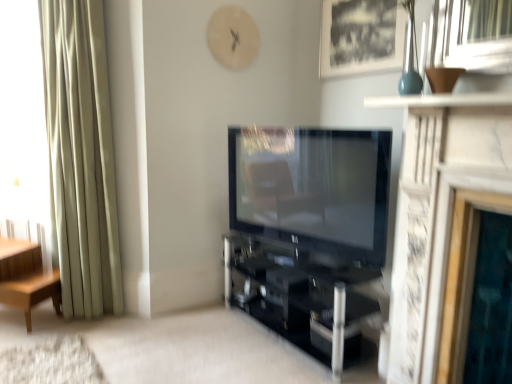
The image size is (512, 384). Describe the element at coordinates (312, 188) in the screenshot. I see `matte black tv at center` at that location.

Locate an element on the screen. The height and width of the screenshot is (384, 512). silky beige curtain at left is located at coordinates (81, 157).

Measure the distance between point (x=399, y=55) and camera.

Point (x=399, y=55) is 7.58 feet from camera.

Where is `black glass shelf at center`? black glass shelf at center is located at coordinates (300, 296).

What do you see at coordinates (26, 277) in the screenshot?
I see `light brown wood side table at left` at bounding box center [26, 277].

This screenshot has height=384, width=512. Find the location of `matte black tv at center`. matte black tv at center is located at coordinates (312, 188).

Considering the sizes of black glass shelf at center and light brown wood side table at left in the image, is black glass shelf at center taller or shorter than light brown wood side table at left?

In the image, black glass shelf at center appears to be shorter than light brown wood side table at left.

In order to click on shelf above the light brown wood side table at left (from a real-world perspective) in this screenshot , I will do `click(300, 296)`.

Between black glass shelf at center and light brown wood side table at left, which one has larger size?

With larger size is black glass shelf at center.

In the image, is black glass shelf at center on the left side or the right side of light brown wood side table at left?

From the image, it's evident that black glass shelf at center is to the right of light brown wood side table at left.

Considering the relative sizes of matte black tv at center and black glass shelf at center in the image provided, is matte black tv at center bigger than black glass shelf at center?

No, matte black tv at center is not bigger than black glass shelf at center.

Considering the positions of objects matte black tv at center and black glass shelf at center in the image provided, who is in front, matte black tv at center or black glass shelf at center?

matte black tv at center is more forward.

From a real-world perspective, which object stands above the other?

From a 3D spatial view, matte black tv at center is above.

Could you tell me if matte black tv at center is facing black glass shelf at center?

No, matte black tv at center is not turned towards black glass shelf at center.

Is silky beige curtain at left at the back of black glass shelf at center?

No, black glass shelf at center is not facing away from silky beige curtain at left.

You are a GUI agent. You are given a task and a screenshot of the screen. Output one action in this format:
    pyautogui.click(x=<x>, y=<y>)
    Task: Click on the shelf below the silky beige curtain at left (from the image's perspective)
    
    Given the screenshot: What is the action you would take?
    pyautogui.click(x=300, y=296)

Does black glass shelf at center have a smaller size compared to silky beige curtain at left?

No.

Considering the points (304, 304) and (84, 135), which point is behind, point (304, 304) or point (84, 135)?

Positioned behind is point (84, 135).

Between silky beige curtain at left and matte black tv at center, which one has smaller size?

Smaller between the two is matte black tv at center.

Is silky beige curtain at left spatially inside matte black tv at center, or outside of it?

silky beige curtain at left is not inside matte black tv at center, it's outside.

From the image's perspective, is silky beige curtain at left beneath matte black tv at center?

No, from the image's perspective, silky beige curtain at left is not below matte black tv at center.

Is silky beige curtain at left far from matte black tv at center?

Yes, silky beige curtain at left and matte black tv at center are located far from each other.

Considering the sizes of black matte picture frame at upper center and light brown wood side table at left in the image, is black matte picture frame at upper center taller or shorter than light brown wood side table at left?

Clearly, black matte picture frame at upper center is taller compared to light brown wood side table at left.

From the image's perspective, between black matte picture frame at upper center and light brown wood side table at left, which one is located above?

black matte picture frame at upper center appears higher in the image.

In the image, is black matte picture frame at upper center on the left side or the right side of light brown wood side table at left?

black matte picture frame at upper center is to the right of light brown wood side table at left.

Considering the sizes of objects black matte picture frame at upper center and light brown wood side table at left in the image provided, who is bigger, black matte picture frame at upper center or light brown wood side table at left?

Bigger between the two is light brown wood side table at left.

Would you say white marble fireplace at center is a long distance from light brown wood side table at left?

Yes, white marble fireplace at center is far from light brown wood side table at left.

Considering the relative positions of white marble fireplace at center and light brown wood side table at left in the image provided, is white marble fireplace at center in front of light brown wood side table at left?

Yes, white marble fireplace at center is in front of light brown wood side table at left.

Considering the sizes of objects white marble fireplace at center and light brown wood side table at left in the image provided, who is thinner, white marble fireplace at center or light brown wood side table at left?

Thinner between the two is light brown wood side table at left.

Is silky beige curtain at left wider or thinner than black glass shelf at center?

Considering their sizes, silky beige curtain at left looks slimmer than black glass shelf at center.

From a real-world perspective, is silky beige curtain at left above or below black glass shelf at center?

In terms of real-world spatial position, silky beige curtain at left is above black glass shelf at center.

Does silky beige curtain at left have a larger size compared to black glass shelf at center?

No, silky beige curtain at left is not bigger than black glass shelf at center.

Is silky beige curtain at left at the right side of black glass shelf at center?

No.

The image size is (512, 384). Find the location of `furniture that is under the black glass shelf at center (from a real-world perspective)`. furniture that is under the black glass shelf at center (from a real-world perspective) is located at coordinates (26, 277).

Image resolution: width=512 pixels, height=384 pixels. I want to click on shelf to the right of matte black tv at center, so click(x=300, y=296).

Which object lies nearer to the anchor point black matte picture frame at upper center, silky beige curtain at left or white marble fireplace at center?

Among the two, white marble fireplace at center is located nearer to black matte picture frame at upper center.

Looking at the image, which one is located further to black glass shelf at center, white marble fireplace at center or matte black tv at center?

white marble fireplace at center.

From the image, which object appears to be nearer to black glass shelf at center, black matte picture frame at upper center or light brown wood side table at left?

The object closer to black glass shelf at center is black matte picture frame at upper center.

Based on their spatial positions, is matte black tv at center or silky beige curtain at left closer to light brown wood side table at left?

Among the two, silky beige curtain at left is located nearer to light brown wood side table at left.

Based on their spatial positions, is white marble fireplace at center or black matte picture frame at upper center further from matte black tv at center?

black matte picture frame at upper center is further to matte black tv at center.

Looking at the image, which one is located further to light brown wood side table at left, black glass shelf at center or matte black tv at center?

The object further to light brown wood side table at left is matte black tv at center.

In the scene shown: Looking at the image, which one is located closer to silky beige curtain at left, black matte picture frame at upper center or black glass shelf at center?

The object closer to silky beige curtain at left is black glass shelf at center.

Based on their spatial positions, is matte black tv at center or white marble fireplace at center further from silky beige curtain at left?

The object further to silky beige curtain at left is white marble fireplace at center.

Find the location of a particular element. television between black matte picture frame at upper center and black glass shelf at center in the up-down direction is located at coordinates (312, 188).

Image resolution: width=512 pixels, height=384 pixels. Find the location of `fireplace between black matte picture frame at upper center and black glass shelf at center from top to bottom`. fireplace between black matte picture frame at upper center and black glass shelf at center from top to bottom is located at coordinates (442, 224).

Image resolution: width=512 pixels, height=384 pixels. What are the coordinates of `picture frame between silky beige curtain at left and white marble fireplace at center` in the screenshot? It's located at (361, 36).

At what (x,y) coordinates should I click in order to perform the action: click on television that lies between black matte picture frame at upper center and white marble fireplace at center from top to bottom. Please return your answer as a coordinate pair (x, y). Image resolution: width=512 pixels, height=384 pixels. Looking at the image, I should click on (312, 188).